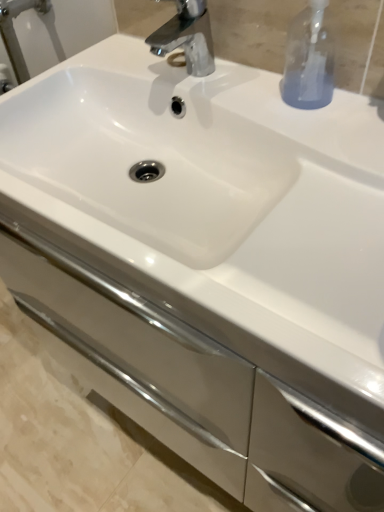
At what (x,y) coordinates should I click in order to perform the action: click on free spot to the left of polished chrome faucet at upper center. Please return your answer as a coordinate pair (x, y). Image resolution: width=384 pixels, height=512 pixels. Looking at the image, I should click on (94, 73).